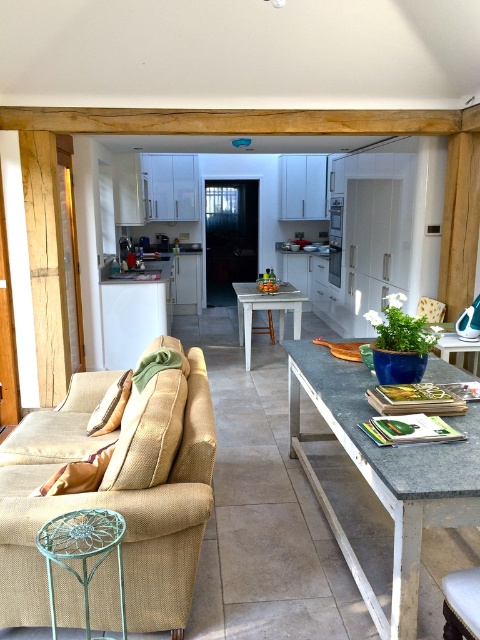
Is granite white table at center below white painted wood table at center?

Correct, granite white table at center is located below white painted wood table at center.

Between granite white table at center and white painted wood table at center, which one is positioned higher?

Positioned higher is white painted wood table at center.

What do you see at coordinates (384, 476) in the screenshot? I see `granite white table at center` at bounding box center [384, 476].

The image size is (480, 640). I want to click on granite white table at center, so click(x=384, y=476).

From the picture: Who is taller, white painted wood table at center or granite table at center?

With more height is white painted wood table at center.

Is point (238, 288) less distant than point (476, 352)?

No, (238, 288) is behind (476, 352).

Locate an element on the screen. The width and height of the screenshot is (480, 640). white painted wood table at center is located at coordinates (265, 308).

Looking at this image, is granite white table at center positioned in front of beige fabric armchair at center?

That is True.

In order to click on granite white table at center in this screenshot , I will do `click(384, 476)`.